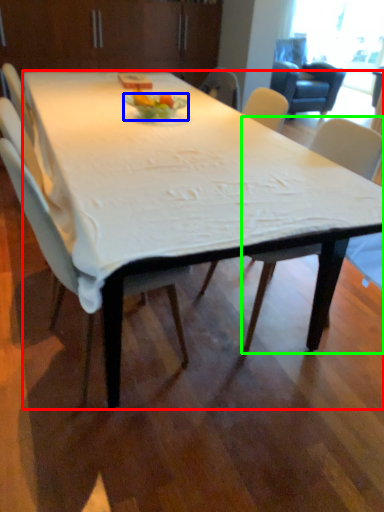
Question: Based on their relative distances, which object is farther from desk (highlighted by a red box)? Choose from plate (highlighted by a blue box) and chair (highlighted by a green box).

Choices:
 (A) plate
 (B) chair

Answer: (A)